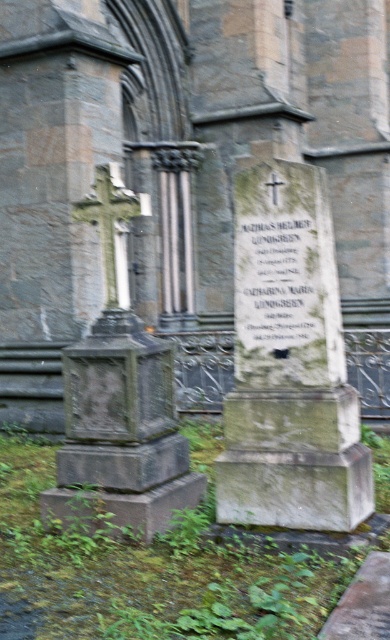
You are standing in the cemetery looking towards the church. You see the green stone gravestone at center and the granite cross at left. Which object is closer to the church?

The green stone gravestone at center is closer to the church because it is positioned below the granite cross at left, indicating it is in front of it.

You are standing in a cemetery near a stone church and see the stone cross at center and the green stone gravestone at center. Which object is taller?

The stone cross at center is taller than the green stone gravestone at center.

You are a historian examining the cemetery scene. You notice the stone cross at center and the white stone inscription at center. Which object would cast a longer shadow if the sun is directly overhead?

The stone cross at center is larger in size than the white stone inscription at center, so it would cast a longer shadow.